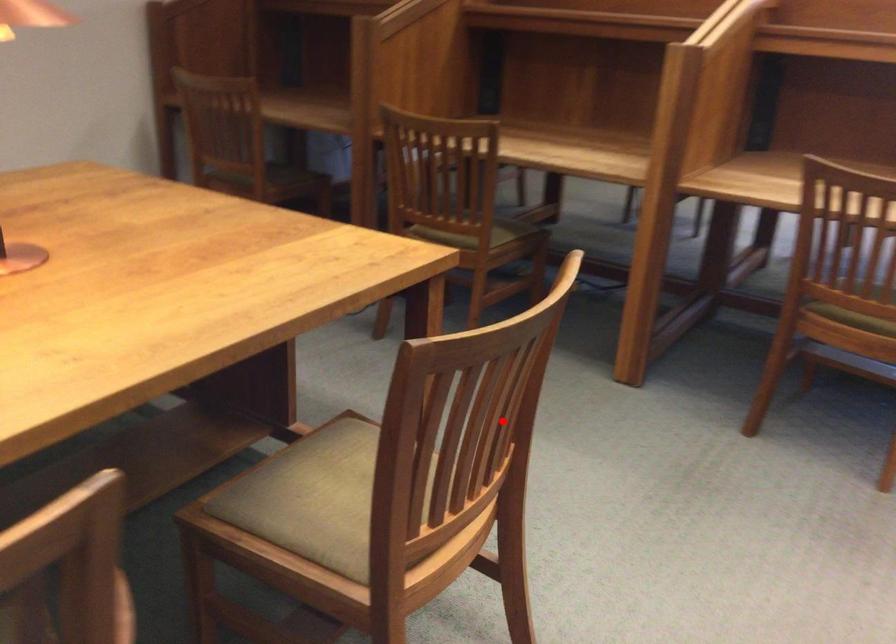
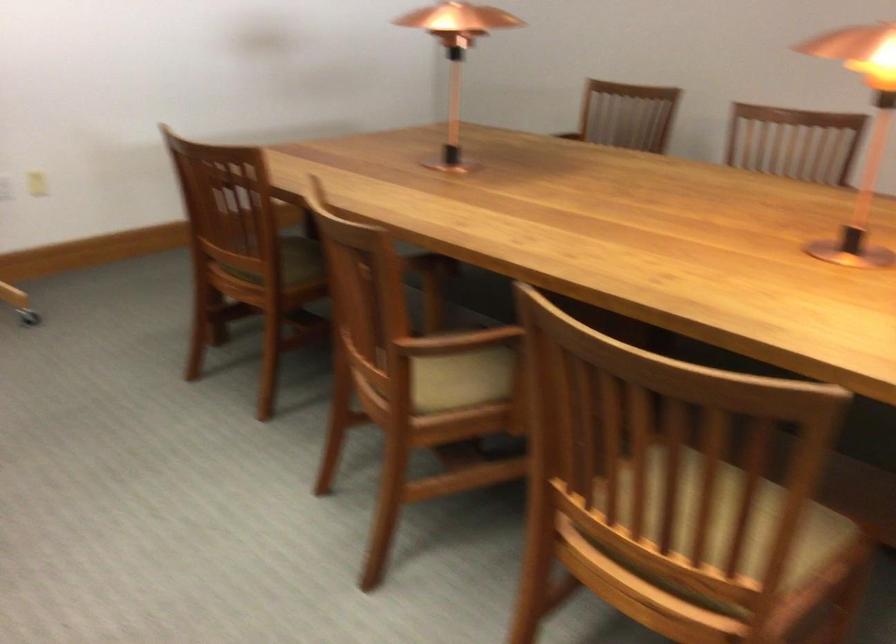
In the second image, find the point that corresponds to the highlighted location in the first image.

(728, 526)